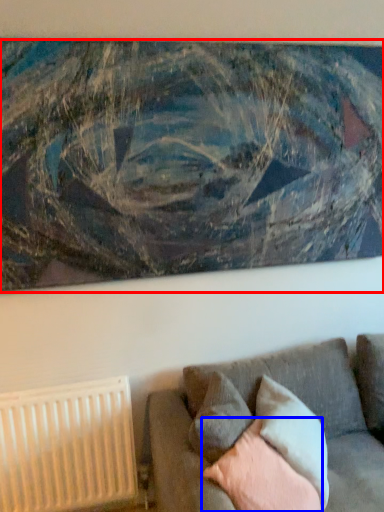
Question: Among these objects, which one is farthest to the camera, picture frame (highlighted by a red box) or pillow (highlighted by a blue box)?

Choices:
 (A) picture frame
 (B) pillow

Answer: (A)